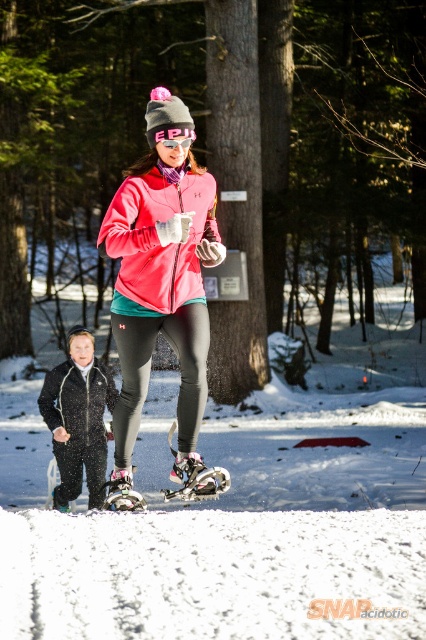
Question: Which object is the closest to the transparent plastic goggles at center?

Choices:
 (A) black fleece jacket at lower left
 (B) matte pink jacket at center

Answer: (B)

Question: Can you confirm if matte pink jacket at center is smaller than pink fleece jacket at center?

Choices:
 (A) yes
 (B) no

Answer: (B)

Question: Which point is farther to the camera?

Choices:
 (A) (63, 554)
 (B) (74, 438)

Answer: (B)

Question: Estimate the real-world distances between objects in this image. Which object is farther from the matte pink jacket at center?

Choices:
 (A) transparent plastic goggles at center
 (B) black fleece jacket at lower left

Answer: (B)

Question: Does matte pink jacket at center appear on the left side of pink fleece jacket at center?

Choices:
 (A) no
 (B) yes

Answer: (A)

Question: Observing the image, what is the correct spatial positioning of black fleece jacket at lower left in reference to transparent plastic goggles at center?

Choices:
 (A) above
 (B) below

Answer: (B)